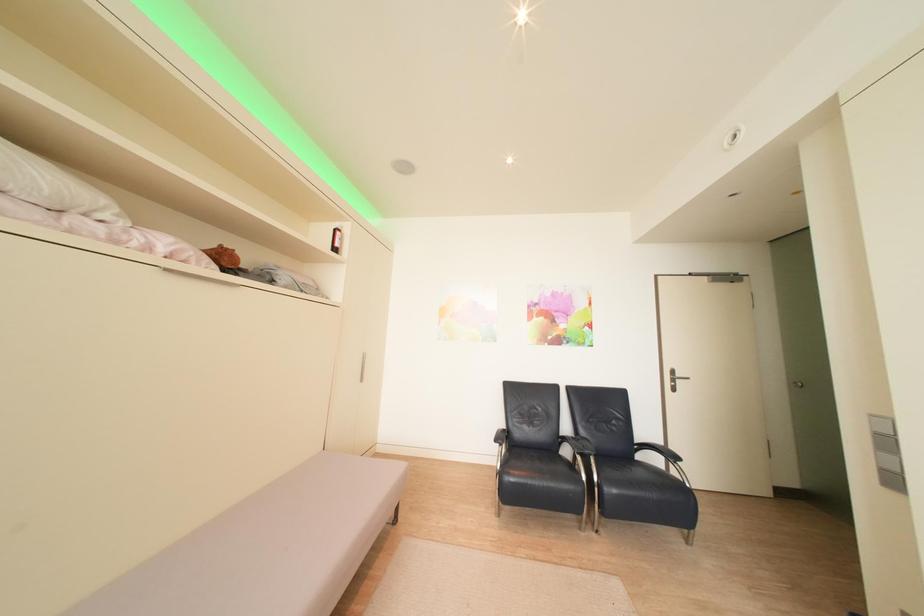
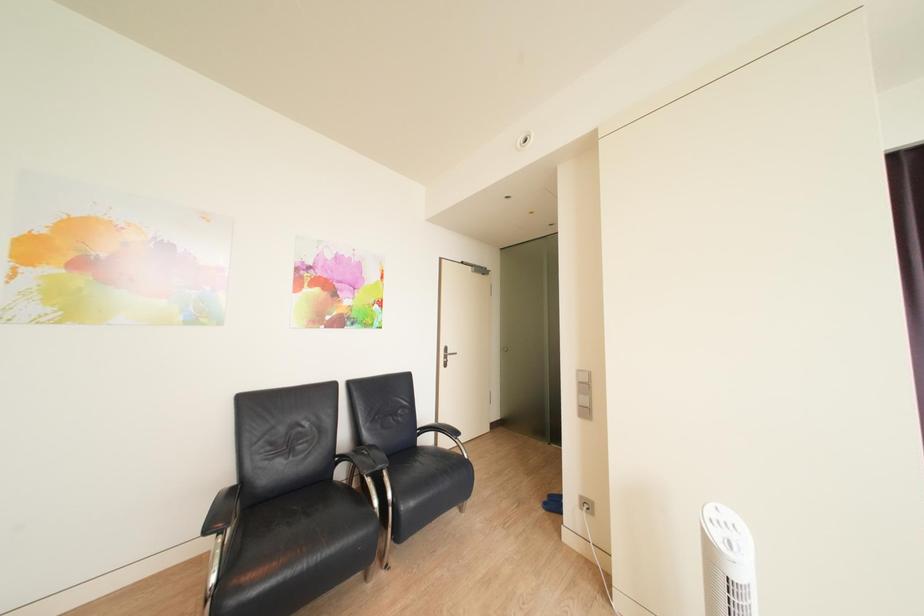
Question: How did the camera likely rotate?

Choices:
 (A) Left
 (B) Right
 (C) Up
 (D) Down

Answer: (B)